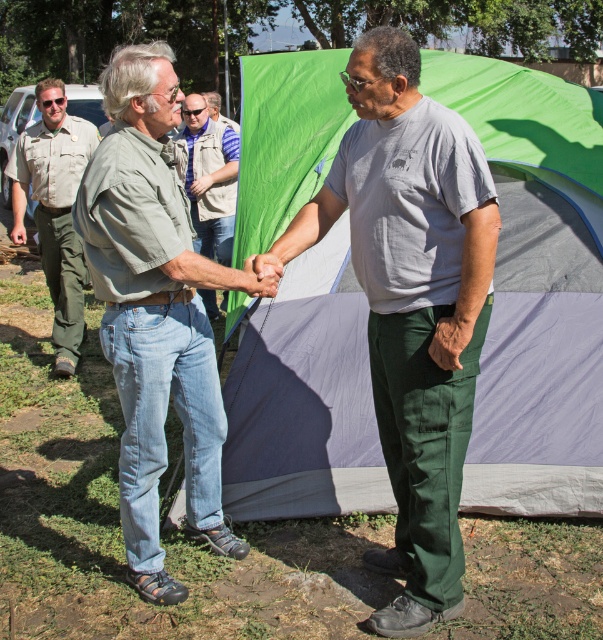
Question: Which object is positioned farthest from the gray cotton shirt at center?

Choices:
 (A) brushed metal uniform at left
 (B) green denim jeans at center

Answer: (A)

Question: Which of the following is the closest to the observer?

Choices:
 (A) green denim jeans at center
 (B) safari shirt at center
 (C) gray cotton shirt at center
 (D) brushed metal uniform at left

Answer: (C)

Question: Can you confirm if gray cotton shirt at center is wider than safari shirt at center?

Choices:
 (A) no
 (B) yes

Answer: (B)

Question: Which of the following is the farthest from the observer?

Choices:
 (A) gray cotton shirt at center
 (B) safari shirt at center
 (C) green denim jeans at center
 (D) brushed metal uniform at left

Answer: (D)

Question: Does gray cotton shirt at center appear under brushed metal uniform at left?

Choices:
 (A) yes
 (B) no

Answer: (A)

Question: Where is gray cotton shirt at center located in relation to green denim jeans at center in the image?

Choices:
 (A) left
 (B) right

Answer: (B)